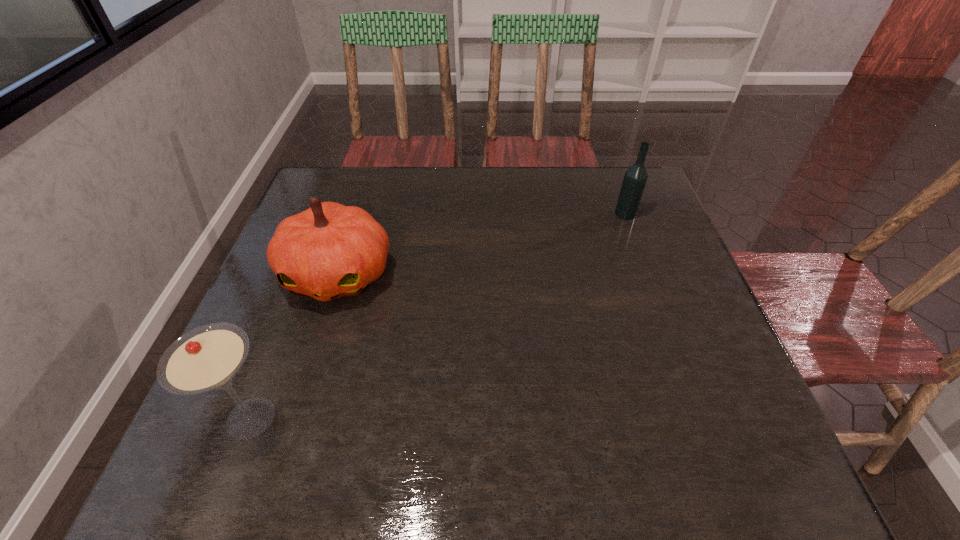
Where is `pumpkin`? pumpkin is located at coordinates (328, 251).

Find the location of `the rightmost object`. the rightmost object is located at coordinates (635, 178).

This screenshot has width=960, height=540. Identify the location of vodka. (635, 178).

Identify the location of the nearest object. The image size is (960, 540). (207, 358).

You are a GUI agent. You are given a task and a screenshot of the screen. Output one action in this format:
    pyautogui.click(x=<x>, y=<y>)
    Task: Click on the free spot located 0.310m on the front-facing side of the second farthest object
    
    Given the screenshot: What is the action you would take?
    pyautogui.click(x=281, y=455)

Find the location of a particular element. vacant space situated on the back of the farthest object is located at coordinates (615, 187).

I want to click on free location located 0.370m on the right of the nearest object, so click(488, 418).

Identify the location of object situated at the far edge. (635, 178).

This screenshot has width=960, height=540. What are the coordinates of `object situated at the near edge` in the screenshot? It's located at (207, 358).

The image size is (960, 540). Identify the location of pumpkin that is at the left edge. (328, 251).